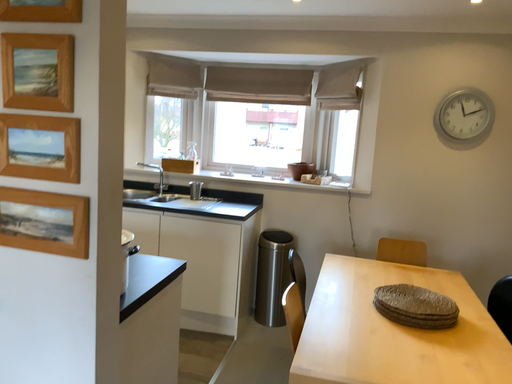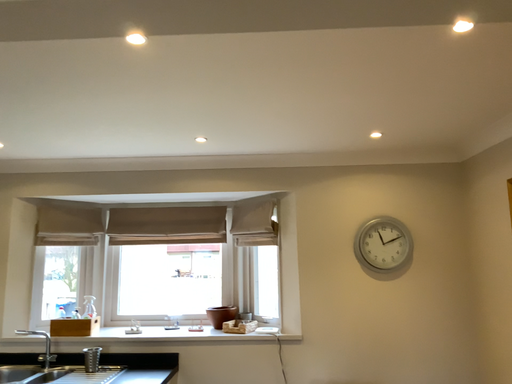
Question: Which way did the camera rotate in the video?

Choices:
 (A) rotated upward
 (B) rotated downward

Answer: (A)